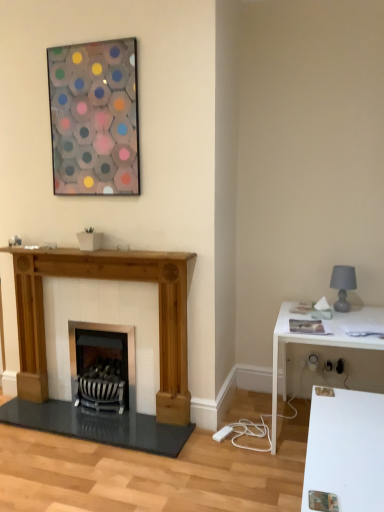
Identify the location of black striped wood burning stove at center. The width and height of the screenshot is (384, 512). (102, 366).

You are a GUI agent. You are given a task and a screenshot of the screen. Output one action in this format:
    pyautogui.click(x=<x>, y=<y>)
    Task: Click on the natural wood fireplace at left
    The width and height of the screenshot is (384, 512).
    Given the screenshot: What is the action you would take?
    coord(126,385)

Identify the location of white glossy table at right. The image size is (384, 512). point(320,343).

The height and width of the screenshot is (512, 384). I want to click on black striped wood burning stove at center, so click(x=102, y=366).

Locate an element on the screen. This screenshot has height=512, width=384. picture frame to the left of white glossy table at right is located at coordinates (94, 118).

Considering the relative positions of translucent glass hexagon at upper center and white glossy table at right in the image provided, is translucent glass hexagon at upper center to the left of white glossy table at right from the viewer's perspective?

Yes, translucent glass hexagon at upper center is to the left of white glossy table at right.

Is translucent glass hexagon at upper center situated inside white glossy table at right or outside?

translucent glass hexagon at upper center exists outside the volume of white glossy table at right.

Between translucent glass hexagon at upper center and white glossy table at right, which one is positioned behind?

Positioned behind is translucent glass hexagon at upper center.

From the image's perspective, who appears lower, gray matte lampshade at right or translucent glass hexagon at upper center?

gray matte lampshade at right.

Considering the sizes of objects gray matte lampshade at right and translucent glass hexagon at upper center in the image provided, who is thinner, gray matte lampshade at right or translucent glass hexagon at upper center?

With smaller width is translucent glass hexagon at upper center.

Is point (334, 303) closer or farther from the camera than point (113, 106)?

Point (334, 303).

Between point (340, 286) and point (167, 386), which one is positioned in front?

The point (167, 386) is closer.

Can you confirm if gray matte lampshade at right is smaller than natural wood fireplace at left?

Correct, gray matte lampshade at right occupies less space than natural wood fireplace at left.

Is gray matte lampshade at right directly adjacent to natural wood fireplace at left?

gray matte lampshade at right and natural wood fireplace at left are not in contact.

Considering the relative sizes of gray matte lampshade at right and natural wood fireplace at left in the image provided, is gray matte lampshade at right thinner than natural wood fireplace at left?

Indeed, gray matte lampshade at right has a lesser width compared to natural wood fireplace at left.

From the image's perspective, is translucent glass hexagon at upper center beneath gray matte lampshade at right?

No, from the image's perspective, translucent glass hexagon at upper center is not beneath gray matte lampshade at right.

Is translucent glass hexagon at upper center next to gray matte lampshade at right and touching it?

No, translucent glass hexagon at upper center is not touching gray matte lampshade at right.

Is point (99, 165) positioned after point (355, 276)?

No.

Between natural wood fireplace at left and black striped wood burning stove at center, which one is positioned behind?

black striped wood burning stove at center.

From the image's perspective, which one is positioned lower, natural wood fireplace at left or black striped wood burning stove at center?

black striped wood burning stove at center, from the image's perspective.

Are natural wood fireplace at left and black striped wood burning stove at center far apart?

They are positioned close to each other.

Does translucent glass hexagon at upper center have a lesser width compared to black striped wood burning stove at center?

Yes, translucent glass hexagon at upper center is thinner than black striped wood burning stove at center.

From the image's perspective, is translucent glass hexagon at upper center located above or below black striped wood burning stove at center?

translucent glass hexagon at upper center is situated higher than black striped wood burning stove at center in the image.

What's the angular difference between translucent glass hexagon at upper center and black striped wood burning stove at center's facing directions?

translucent glass hexagon at upper center and black striped wood burning stove at center are facing 0.699 degrees away from each other.

How much distance is there between translucent glass hexagon at upper center and black striped wood burning stove at center?

translucent glass hexagon at upper center and black striped wood burning stove at center are 4.21 feet apart.

From the image's perspective, would you say black striped wood burning stove at center is shown under gray matte lampshade at right?

Yes, from the image's perspective, black striped wood burning stove at center is beneath gray matte lampshade at right.

From a real-world perspective, who is located lower, black striped wood burning stove at center or gray matte lampshade at right?

In real-world perspective, black striped wood burning stove at center is lower.

Considering the sizes of black striped wood burning stove at center and gray matte lampshade at right in the image, is black striped wood burning stove at center bigger or smaller than gray matte lampshade at right?

Clearly, black striped wood burning stove at center is larger in size than gray matte lampshade at right.

Is black striped wood burning stove at center situated inside gray matte lampshade at right or outside?

The correct answer is: outside.

Locate an element on the screen. The image size is (384, 512). picture frame above the white glossy table at right (from the image's perspective) is located at coordinates (94, 118).

In order to click on lamp below the translucent glass hexagon at upper center (from a real-world perspective) in this screenshot , I will do `click(343, 285)`.

Which object lies nearer to the anchor point gray matte lampshade at right, black striped wood burning stove at center or translucent glass hexagon at upper center?

Among the two, black striped wood burning stove at center is located nearer to gray matte lampshade at right.

From the image, which object appears to be nearer to black striped wood burning stove at center, white glossy table at right or natural wood fireplace at left?

natural wood fireplace at left is positioned closer to the anchor black striped wood burning stove at center.

Looking at the image, which one is located further to natural wood fireplace at left, white glossy table at right or black striped wood burning stove at center?

white glossy table at right.

Estimate the real-world distances between objects in this image. Which object is further from gray matte lampshade at right, white glossy table at right or black striped wood burning stove at center?

Based on the image, black striped wood burning stove at center appears to be further to gray matte lampshade at right.

Estimate the real-world distances between objects in this image. Which object is further from white glossy table at right, black striped wood burning stove at center or translucent glass hexagon at upper center?

translucent glass hexagon at upper center.

When comparing their distances from white glossy table at right, does translucent glass hexagon at upper center or gray matte lampshade at right seem closer?

gray matte lampshade at right is positioned closer to the anchor white glossy table at right.

When comparing their distances from gray matte lampshade at right, does natural wood fireplace at left or translucent glass hexagon at upper center seem closer?

natural wood fireplace at left lies closer to gray matte lampshade at right than the other object.

Which object lies further to the anchor point translucent glass hexagon at upper center, gray matte lampshade at right or black striped wood burning stove at center?

Based on the image, gray matte lampshade at right appears to be further to translucent glass hexagon at upper center.

The image size is (384, 512). What are the coordinates of `wood burning stove between natural wood fireplace at left and white glossy table at right from left to right` in the screenshot? It's located at (102, 366).

Locate an element on the screen. fireplace between translucent glass hexagon at upper center and white glossy table at right from left to right is located at coordinates (126, 385).

Locate an element on the screen. The height and width of the screenshot is (512, 384). table between natural wood fireplace at left and gray matte lampshade at right from left to right is located at coordinates (320, 343).

In order to click on wood burning stove between translucent glass hexagon at upper center and gray matte lampshade at right in this screenshot , I will do `click(102, 366)`.